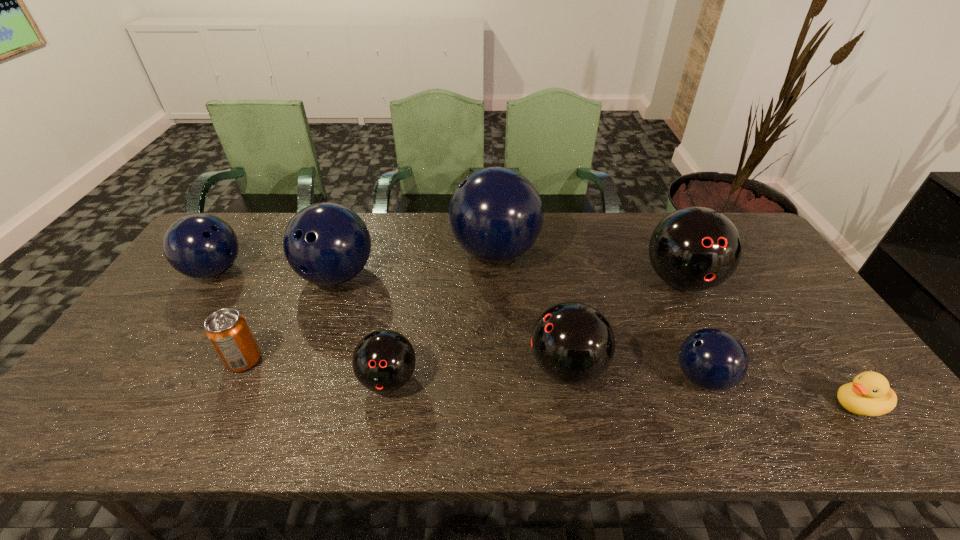
Find the location of a particular element. The width and height of the screenshot is (960, 540). object that stands as the fourth closest to the smallest blue bowling ball is located at coordinates (495, 214).

Identify the location of the second closest object to the rightmost object. The height and width of the screenshot is (540, 960). (694, 249).

You are a GUI agent. You are given a task and a screenshot of the screen. Output one action in this format:
    pyautogui.click(x=<x>, y=<y>)
    Task: Click on the bowling ball that stands as the fourth closest to the third biggest blue bowling ball
    Image resolution: width=960 pixels, height=540 pixels.
    Given the screenshot: What is the action you would take?
    pyautogui.click(x=573, y=343)

Image resolution: width=960 pixels, height=540 pixels. What are the coordinates of `bowling ball object that ranks as the fourth closest to the rightmost blue bowling ball` in the screenshot? It's located at (383, 361).

You are a GUI agent. You are given a task and a screenshot of the screen. Output one action in this format:
    pyautogui.click(x=<x>, y=<y>)
    Task: Click on the blue bowling ball that is the third closest to the smallest black bowling ball
    Image resolution: width=960 pixels, height=540 pixels.
    Given the screenshot: What is the action you would take?
    [x=201, y=246]

This screenshot has height=540, width=960. Identify the location of blue bowling ball that is the second closest one to the second black bowling ball from left to right. (495, 214).

You are a GUI agent. You are given a task and a screenshot of the screen. Output one action in this format:
    pyautogui.click(x=<x>, y=<y>)
    Task: Click on the black bowling ball that stands as the third closest to the duckling
    Image resolution: width=960 pixels, height=540 pixels.
    Given the screenshot: What is the action you would take?
    pyautogui.click(x=383, y=361)

Locate an element on the screen. The height and width of the screenshot is (540, 960). black bowling ball that is the closest one to the farthest black bowling ball is located at coordinates (573, 343).

This screenshot has width=960, height=540. I want to click on free spot that satisfies the following two spatial constraints: 1. on the surface of the biggest black bowling ball near the finger holes; 2. on the surface of the rightmost blue bowling ball near the finger holes, so click(730, 378).